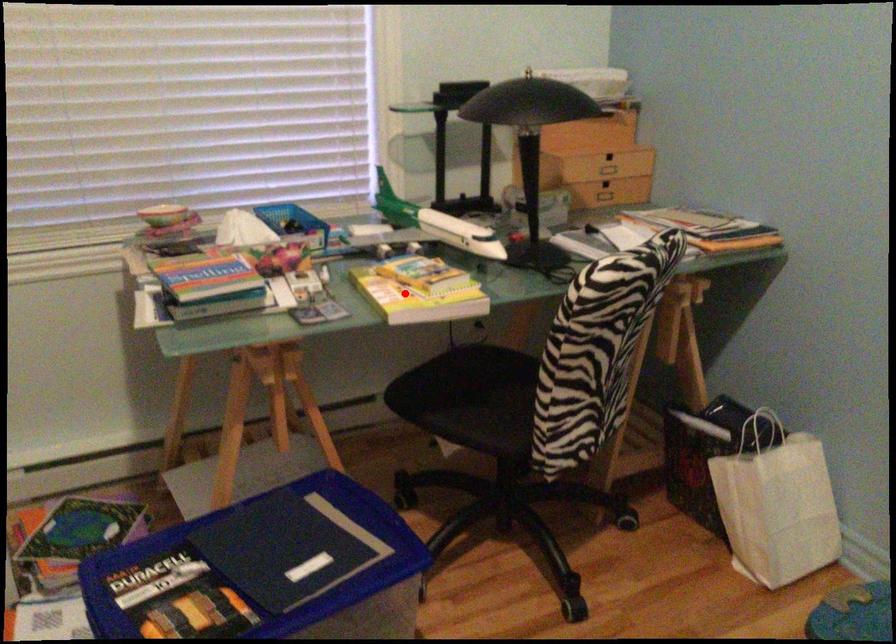
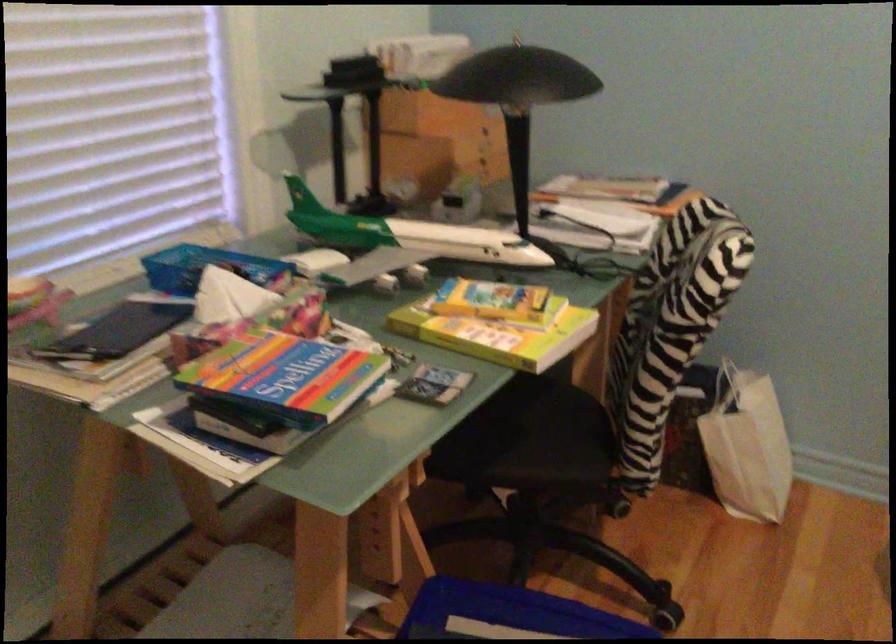
In the second image, find the point that corresponds to the highlighted location in the first image.

(497, 330)